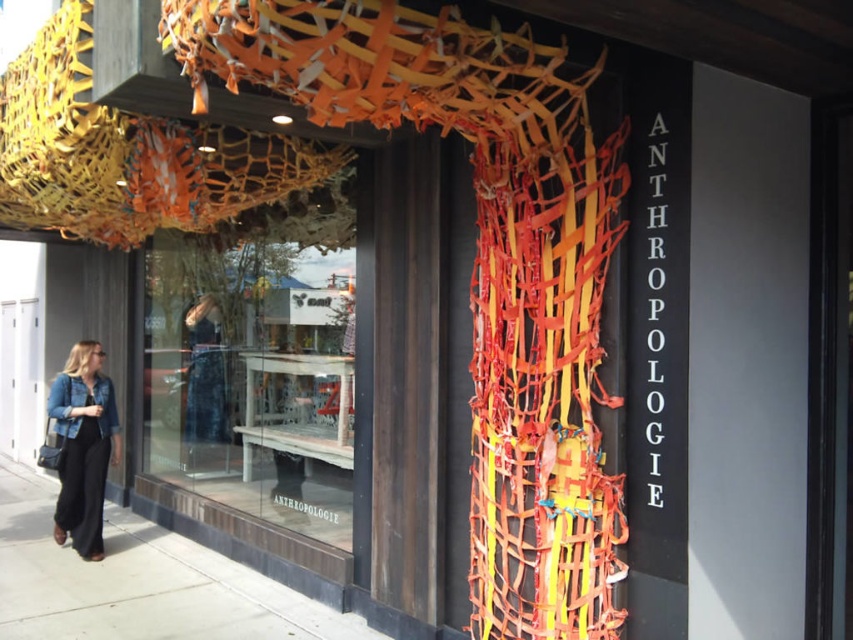
Is point (351, 225) positioned before point (103, 449)?

Yes, point (351, 225) is in front of point (103, 449).

Is point (341, 360) positioned in front of point (73, 406)?

Yes, point (341, 360) is in front of point (73, 406).

Where is `transparent glass display at center`? Image resolution: width=853 pixels, height=640 pixels. transparent glass display at center is located at coordinates (257, 358).

Can you confirm if smooth concrete sidewalk at lower left is thinner than denim jacket at lower left?

No.

Does smooth concrete sidewalk at lower left appear over denim jacket at lower left?

Incorrect, smooth concrete sidewalk at lower left is not positioned above denim jacket at lower left.

The image size is (853, 640). What do you see at coordinates (138, 582) in the screenshot?
I see `smooth concrete sidewalk at lower left` at bounding box center [138, 582].

This screenshot has width=853, height=640. In order to click on smooth concrete sidewalk at lower left in this screenshot , I will do point(138,582).

Who is positioned more to the left, transparent glass display at center or smooth concrete sidewalk at lower left?

From the viewer's perspective, smooth concrete sidewalk at lower left appears more on the left side.

Between point (329, 384) and point (82, 563), which one is positioned in front?

Point (329, 384)

Locate an element on the screen. The image size is (853, 640). transparent glass display at center is located at coordinates (257, 358).